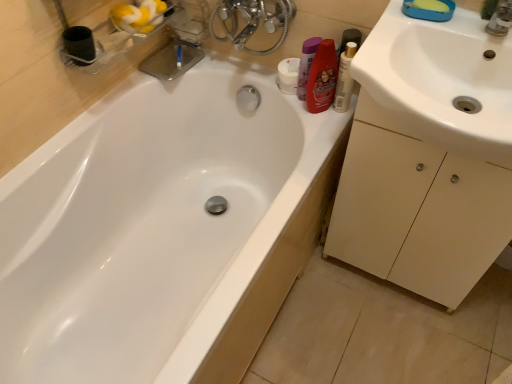
Question: Is yellow sponge at upper right further to camera compared to purple plastic bottle at upper right, positioned as the 2th toiletry in right-to-left order?

Choices:
 (A) yes
 (B) no

Answer: (B)

Question: Is yellow sponge at upper right in contact with purple plastic bottle at upper right, marked as the second toiletry in a left-to-right arrangement?

Choices:
 (A) no
 (B) yes

Answer: (A)

Question: Can you confirm if yellow sponge at upper right is thinner than purple plastic bottle at upper right, positioned as the 2th toiletry in right-to-left order?

Choices:
 (A) yes
 (B) no

Answer: (B)

Question: From the image's perspective, would you say yellow sponge at upper right is positioned over purple plastic bottle at upper right, positioned as the 2th toiletry in right-to-left order?

Choices:
 (A) yes
 (B) no

Answer: (A)

Question: Considering the relative sizes of yellow sponge at upper right and purple plastic bottle at upper right, positioned as the 2th toiletry in right-to-left order, in the image provided, is yellow sponge at upper right wider than purple plastic bottle at upper right, positioned as the 2th toiletry in right-to-left order,?

Choices:
 (A) yes
 (B) no

Answer: (A)

Question: Is yellow sponge at upper right at the right side of purple plastic bottle at upper right, marked as the second toiletry in a left-to-right arrangement?

Choices:
 (A) yes
 (B) no

Answer: (A)

Question: Can you confirm if purple plastic bottle at upper right, positioned as the 2th toiletry in right-to-left order, is smaller than beige matte cabinet at right?

Choices:
 (A) yes
 (B) no

Answer: (A)

Question: From a real-world perspective, is purple plastic bottle at upper right, marked as the second toiletry in a left-to-right arrangement, physically below beige matte cabinet at right?

Choices:
 (A) no
 (B) yes

Answer: (A)

Question: Could beige matte cabinet at right be considered to be inside purple plastic bottle at upper right, marked as the second toiletry in a left-to-right arrangement?

Choices:
 (A) yes
 (B) no

Answer: (B)

Question: Does purple plastic bottle at upper right, marked as the second toiletry in a left-to-right arrangement, have a greater height compared to beige matte cabinet at right?

Choices:
 (A) no
 (B) yes

Answer: (A)

Question: Is purple plastic bottle at upper right, positioned as the 2th toiletry in right-to-left order, to the right of beige matte cabinet at right from the viewer's perspective?

Choices:
 (A) no
 (B) yes

Answer: (A)

Question: From the image's perspective, does purple plastic bottle at upper right, positioned as the 2th toiletry in right-to-left order, appear higher than beige matte cabinet at right?

Choices:
 (A) yes
 (B) no

Answer: (A)

Question: Is white glossy bathtub at upper left shorter than beige matte cabinet at right?

Choices:
 (A) no
 (B) yes

Answer: (B)